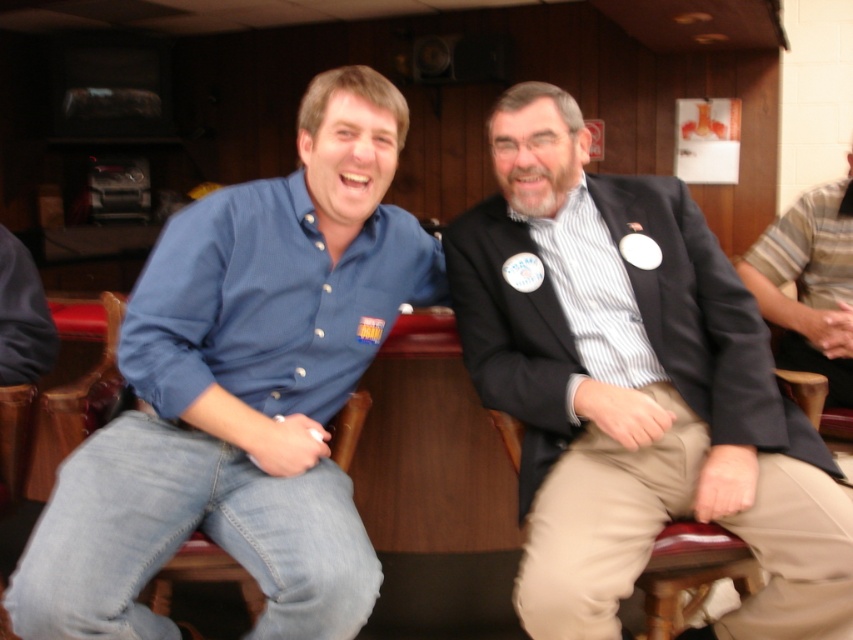
Does blue denim jeans at left have a larger size compared to striped cotton shirt at center?

Yes, blue denim jeans at left is bigger than striped cotton shirt at center.

Is point (222, 496) farther from viewer compared to point (561, 284)?

No.

This screenshot has height=640, width=853. Describe the element at coordinates (242, 390) in the screenshot. I see `blue denim jeans at left` at that location.

You are a GUI agent. You are given a task and a screenshot of the screen. Output one action in this format:
    pyautogui.click(x=<x>, y=<y>)
    Task: Click on the blue denim jeans at left
    
    Given the screenshot: What is the action you would take?
    pyautogui.click(x=242, y=390)

Does point (531, 522) come behind point (767, 317)?

No, (531, 522) is in front of (767, 317).

Does khaki pants at center have a lesser width compared to striped cotton shirt at right?

Incorrect, khaki pants at center's width is not less than striped cotton shirt at right's.

In order to click on khaki pants at center in this screenshot , I will do `click(604, 522)`.

Who is positioned more to the right, striped cotton shirt at right or striped cotton shirt at center?

striped cotton shirt at right

Can you confirm if striped cotton shirt at right is taller than striped cotton shirt at center?

Correct, striped cotton shirt at right is much taller as striped cotton shirt at center.

What are the coordinates of `striped cotton shirt at right` in the screenshot? It's located at (810, 284).